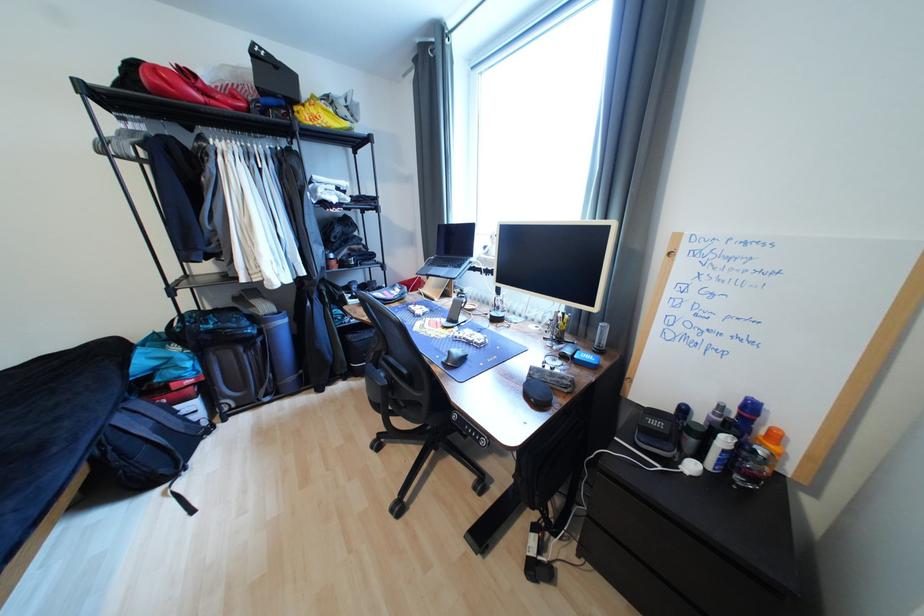
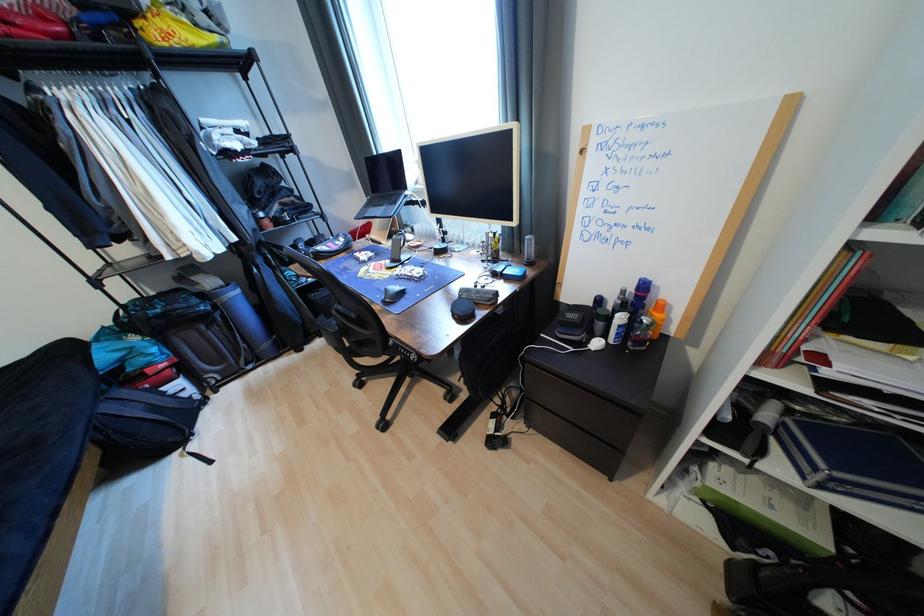
Locate, in the second image, the point that corresponds to pixel 732 442 in the first image.

(627, 320)